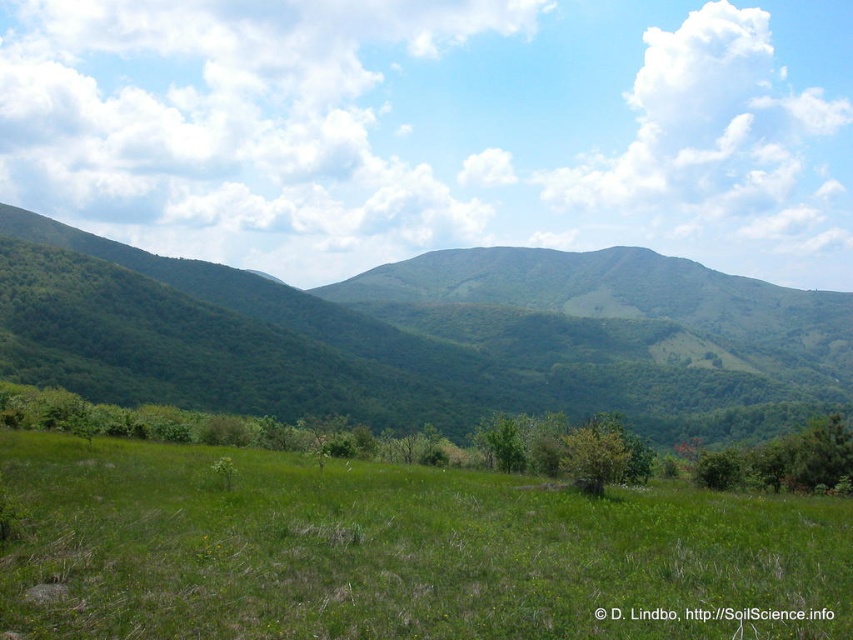
Does green leafy mountain at center have a lesser width compared to green leafy tree at center?

Incorrect, green leafy mountain at center's width is not less than green leafy tree at center's.

Is point (526, 316) in front of point (573, 445)?

No, it is not.

Does point (482, 396) come in front of point (564, 444)?

That is False.

Where is `green leafy mountain at center`? The width and height of the screenshot is (853, 640). green leafy mountain at center is located at coordinates (373, 346).

Can you confirm if green grassy field at center is positioned below green leafy tree at center?

Incorrect, green grassy field at center is not positioned below green leafy tree at center.

Locate an element on the screen. This screenshot has height=640, width=853. green grassy field at center is located at coordinates coord(395,552).

Who is taller, green grassy field at center or green leafy mountain at center?

green leafy mountain at center is taller.

Can you confirm if green grassy field at center is positioned below green leafy mountain at center?

Yes.

What do you see at coordinates (395, 552) in the screenshot?
I see `green grassy field at center` at bounding box center [395, 552].

I want to click on green grassy field at center, so click(x=395, y=552).